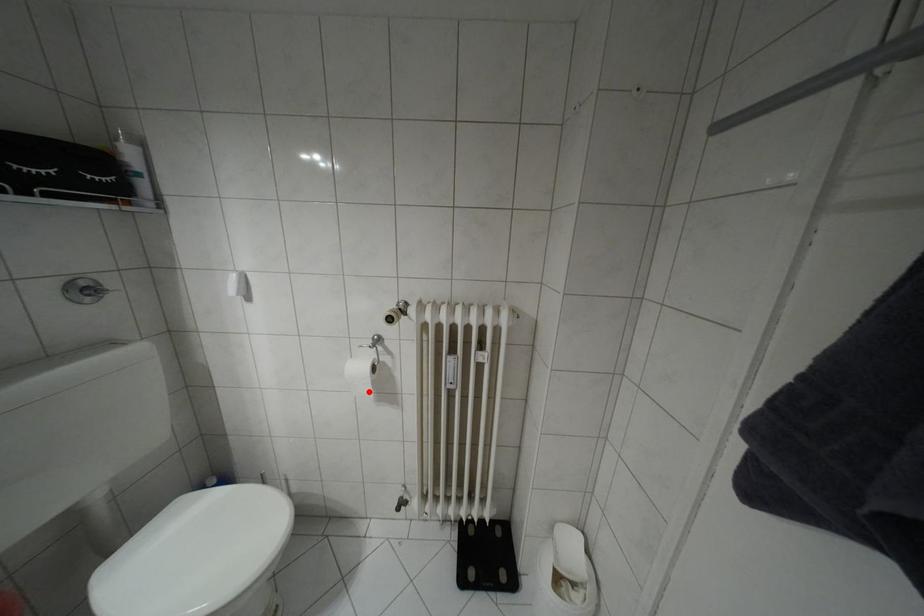
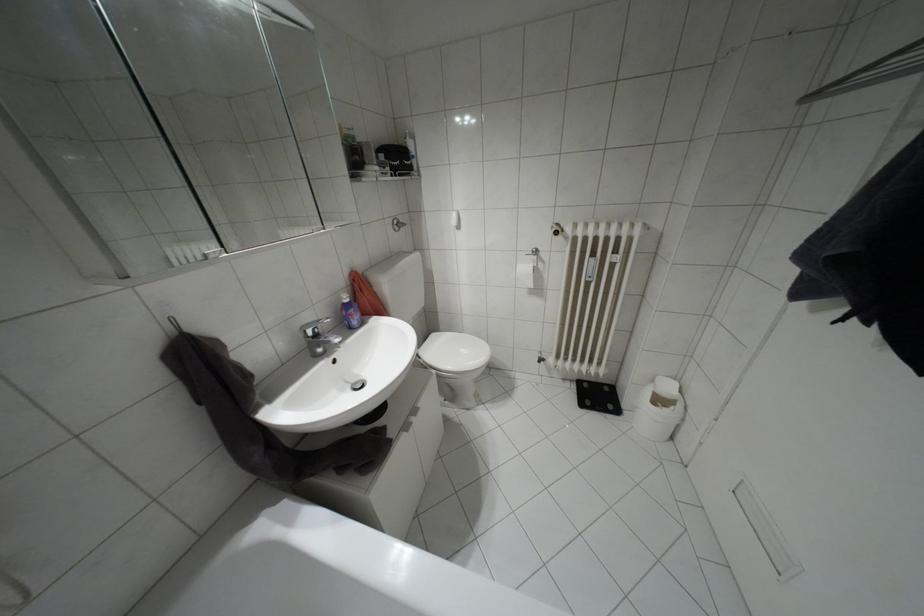
Locate, in the second image, the point that corresponds to the highlighted location in the first image.

(530, 284)